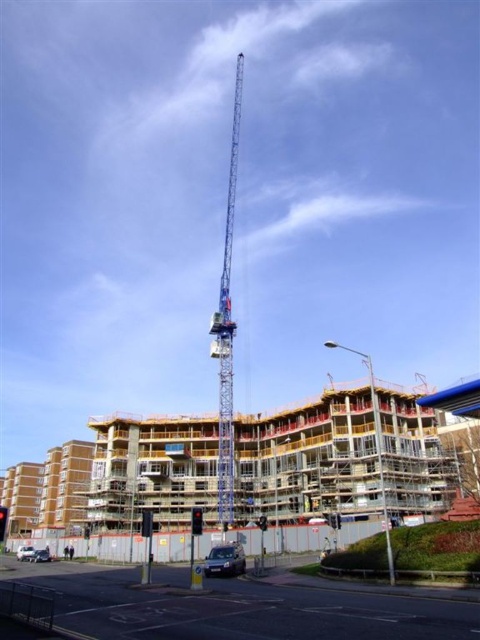
Does silver metallic car at lower left appear under shiny silver car at lower left?

Indeed, silver metallic car at lower left is positioned under shiny silver car at lower left.

Can you confirm if silver metallic car at lower left is positioned above shiny silver car at lower left?

No.

The width and height of the screenshot is (480, 640). In order to click on silver metallic car at lower left in this screenshot , I will do `click(25, 552)`.

Does metallic silver car at lower center have a lesser height compared to silver metallic car at lower left?

In fact, metallic silver car at lower center may be taller than silver metallic car at lower left.

Looking at this image, which of these two, metallic silver car at lower center or silver metallic car at lower left, stands shorter?

silver metallic car at lower left is shorter.

Image resolution: width=480 pixels, height=640 pixels. What are the coordinates of `metallic silver car at lower center` in the screenshot? It's located at (225, 561).

Identify the location of metallic silver car at lower center. The image size is (480, 640). (225, 561).

Does metallic silver car at lower center have a larger size compared to shiny silver car at lower left?

Correct, metallic silver car at lower center is larger in size than shiny silver car at lower left.

Looking at this image, is metallic silver car at lower center further to camera compared to shiny silver car at lower left?

No, it is not.

Image resolution: width=480 pixels, height=640 pixels. In order to click on metallic silver car at lower center in this screenshot , I will do `click(225, 561)`.